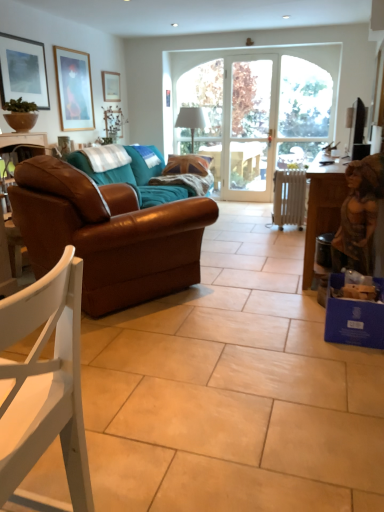
You are a GUI agent. You are given a task and a screenshot of the screen. Output one action in this format:
    pyautogui.click(x=<x>, y=<y>)
    Task: Click on the vacant space in between brown leather couch at left and blue cardboard box at lower right
    The image size is (384, 512).
    Given the screenshot: What is the action you would take?
    pyautogui.click(x=240, y=313)